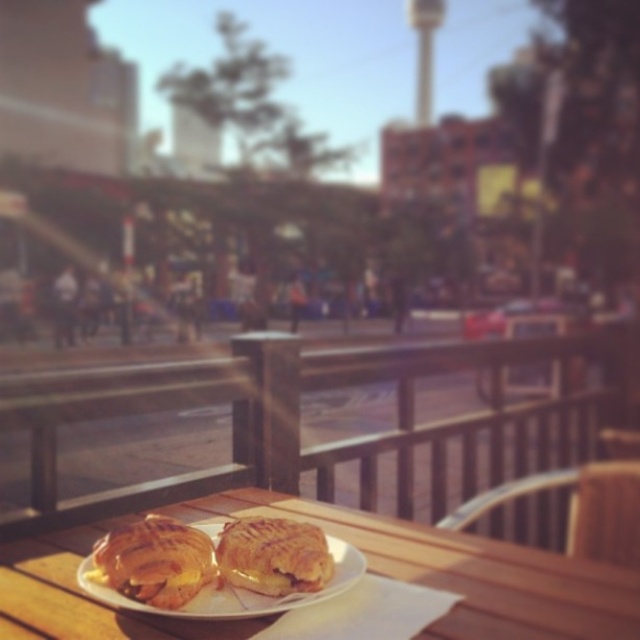
Which of these two, wooden table at center or golden flaky croissant at center, stands taller?

golden flaky croissant at center is taller.

Is the position of wooden table at center more distant than that of golden flaky croissant at center?

No.

Measure the distance between wooden table at center and camera.

The distance of wooden table at center from camera is 24.09 inches.

You are a GUI agent. You are given a task and a screenshot of the screen. Output one action in this format:
    pyautogui.click(x=<x>, y=<y>)
    Task: Click on the wooden table at center
    This screenshot has height=640, width=640.
    Given the screenshot: What is the action you would take?
    pyautogui.click(x=461, y=570)

Based on the photo, can you confirm if wooden table at center is thinner than white paper plate at center?

In fact, wooden table at center might be wider than white paper plate at center.

In the scene shown: Does wooden table at center appear over white paper plate at center?

No.

Does point (10, 566) lie behind point (106, 598)?

Yes.

Where is `wooden table at center`? wooden table at center is located at coordinates (461, 570).

Who is lower down, golden flaky croissant at center or golden flaky pastry at center?

Positioned lower is golden flaky croissant at center.

Which is behind, point (148, 604) or point (298, 545)?

The point (298, 545) is behind.

Image resolution: width=640 pixels, height=640 pixels. Describe the element at coordinates (154, 561) in the screenshot. I see `golden flaky croissant at center` at that location.

The width and height of the screenshot is (640, 640). Find the location of `golden flaky croissant at center`. golden flaky croissant at center is located at coordinates (154, 561).